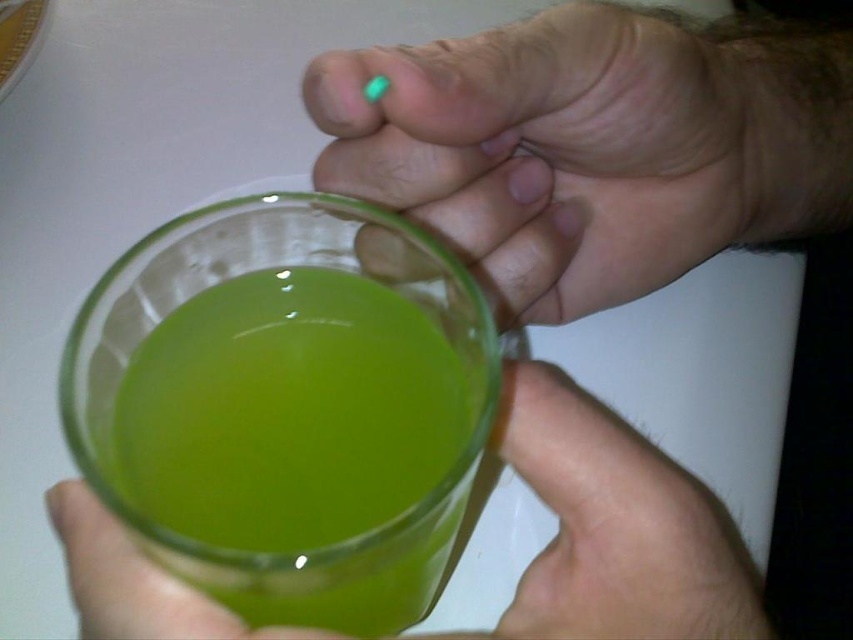
You are a bartender preparing a drink and need to place the matte green glass at upper center on a shelf that is 8 inches away from you. Can you safely place it there without it falling off?

The matte green glass at upper center is 7.81 inches from the viewer, so placing it on an 8 inch shelf would be safe as it will fit within the shelf space.

You are a photographer trying to capture a closeup of the glass in the image. The focus point of your camera is set at point (457, 396). If the depth of field allows objects within 7 inches of the focus point to be in focus, will the liquid inside the glass be in focus?

The distance of point (457, 396) from camera is 8.04 inches. Since the depth of field requires objects within 7 inches to be in focus, the liquid inside the glass will not be in focus as it is slightly beyond the 7 inch threshold.

You are holding a glass of bright green liquid with your hands. A point on the glass at coordinate point (407,173) is 10.08 inches away from you. If your hand is 8 inches wide, can your hand reach that point on the glass?

The point (407,173) is 10.08 inches away from you. Since your hand is 8 inches wide, it cannot reach the point as the distance is greater than the hand width.